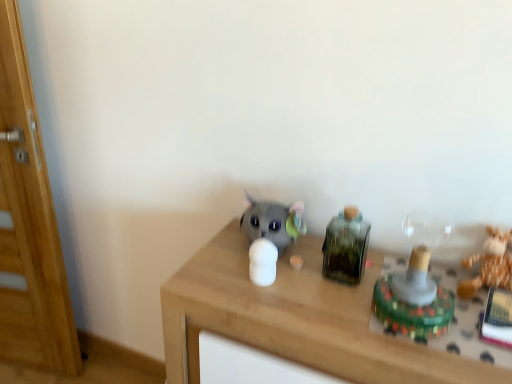
I want to click on free space in front of matte gray plush toy at center, arranged as the 4th toy when viewed from the right, so click(x=278, y=292).